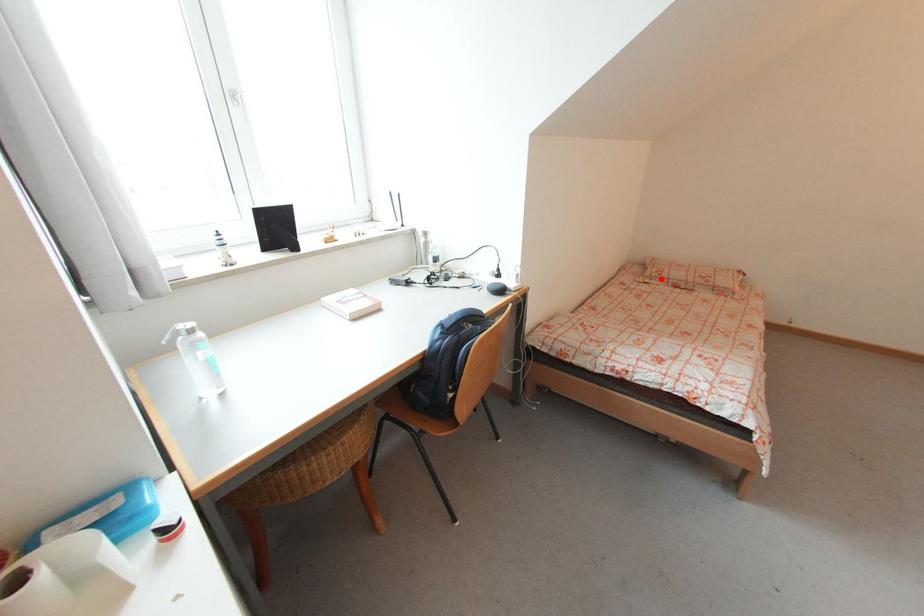
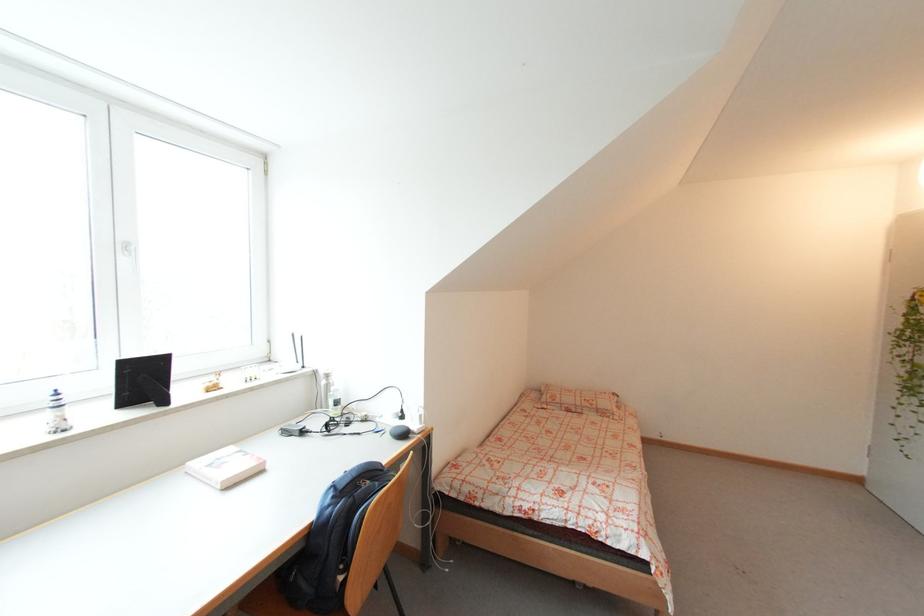
Question: I am providing you with two images of the same scene from different viewpoints. Given a red point in image1, look at the same physical point in image2. Is it:

Choices:
 (A) Closer to the viewpoint
 (B) Farther from the viewpoint

Answer: (B)